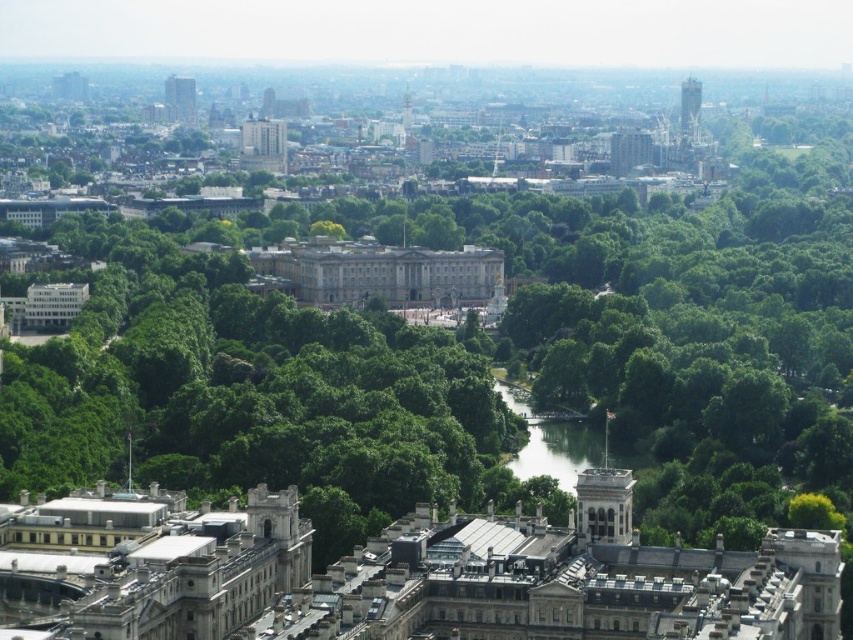
Does green leafy trees at center lie in front of green grassy river at center?

That is False.

Between green leafy trees at center and green grassy river at center, which one is positioned higher?

green leafy trees at center

Which is behind, point (194, 381) or point (517, 458)?

Point (517, 458)

Find the location of a particular element. The width and height of the screenshot is (853, 640). green leafy trees at center is located at coordinates (254, 397).